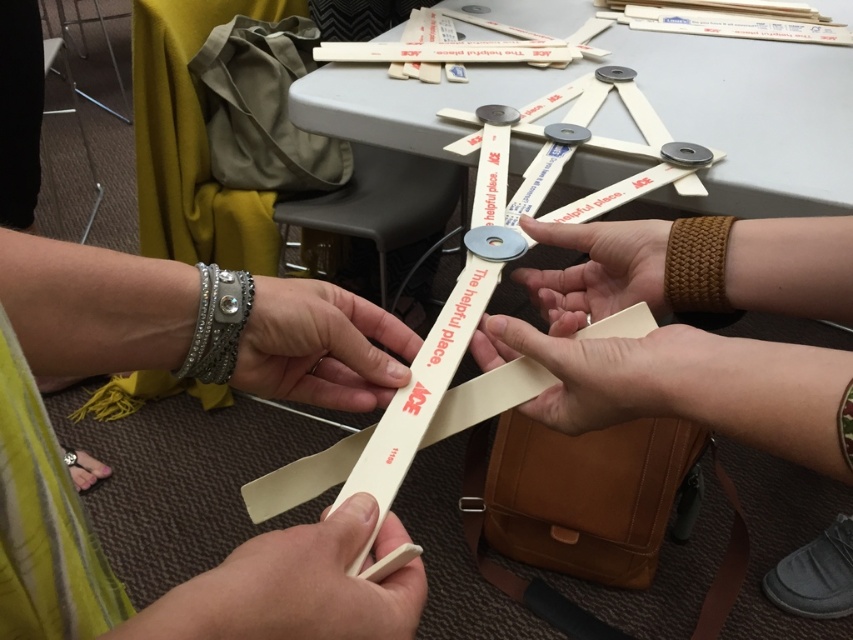
You are trying to determine which of the two points in the image is closer to you. The points are labeled as point (701, 240) and point (497, 257). Based on the scene description, which point is nearer to your viewpoint?

Point (701, 240) is closer to the viewer than point (497, 257).

You are trying to decide which bracelet to wear for a casual day out. Both the matte white bracelet at lower left and the silver beaded bracelet at lower left are options. Based on their sizes, which one would be more comfortable for all day wear?

The matte white bracelet at lower left is larger in size compared to the silver beaded bracelet at lower left, so it would be more comfortable for all day wear as larger bracelets typically allow more comfort over extended periods.